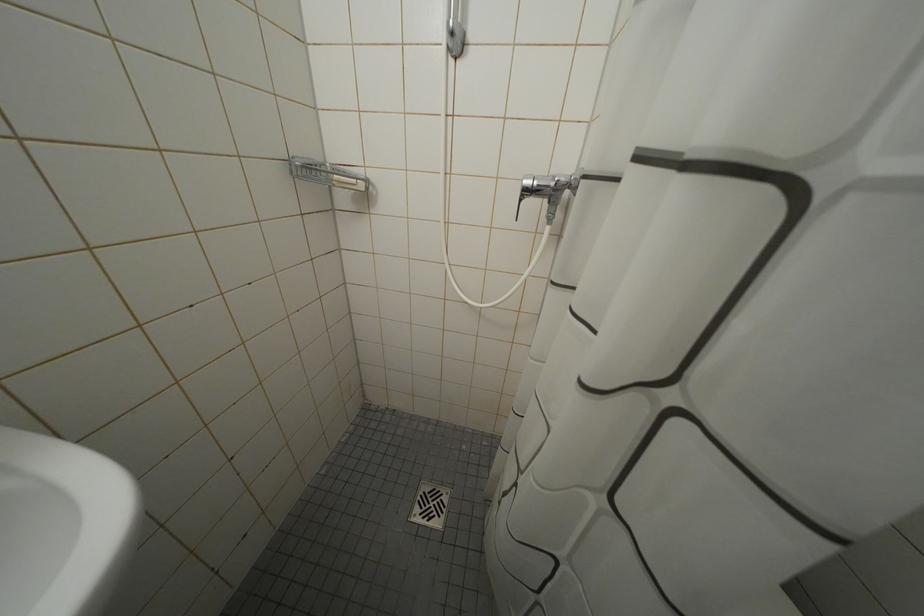
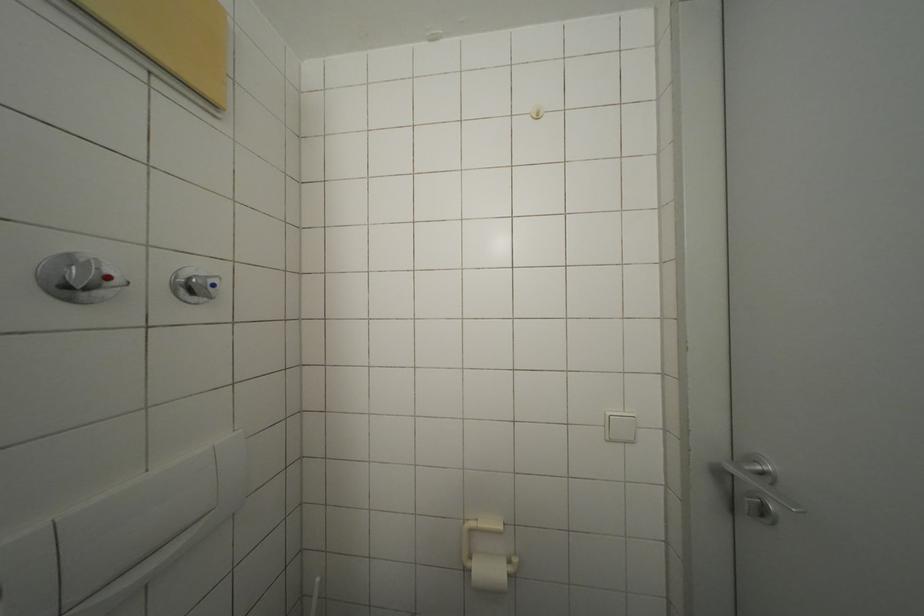
Question: The first image is from the beginning of the video and the second image is from the end. How did the camera likely rotate when shooting the video?

Choices:
 (A) Left
 (B) Right
 (C) Up
 (D) Down

Answer: (B)